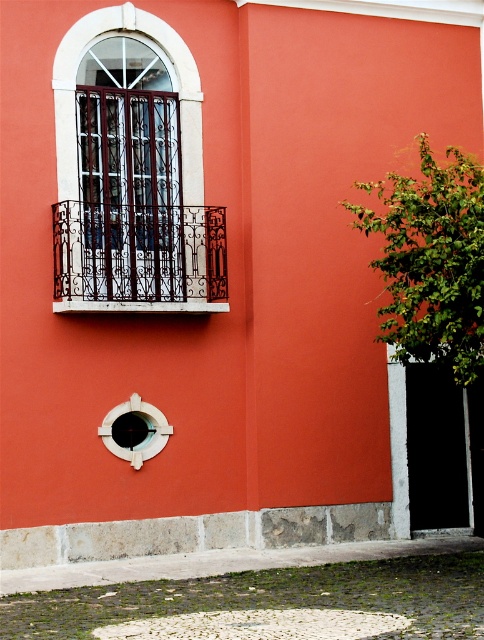
Question: Which object is closer to the camera taking this photo?

Choices:
 (A) smooth white circle at center
 (B) white plastic hole at lower center

Answer: (B)

Question: Among these objects, which one is nearest to the camera?

Choices:
 (A) white wrought iron balcony at upper left
 (B) white plastic hole at lower center
 (C) matte black metal bars at upper left
 (D) smooth white circle at center

Answer: (A)

Question: Does matte black metal bars at upper left appear on the left side of smooth white circle at center?

Choices:
 (A) no
 (B) yes

Answer: (A)

Question: Can you confirm if white wrought iron balcony at upper left is thinner than white plastic hole at lower center?

Choices:
 (A) yes
 (B) no

Answer: (B)

Question: Estimate the real-world distances between objects in this image. Which object is closer to the white plastic hole at lower center?

Choices:
 (A) smooth white circle at center
 (B) white wrought iron balcony at upper left
 (C) matte black metal bars at upper left

Answer: (A)

Question: Can you confirm if white wrought iron balcony at upper left is positioned below white plastic hole at lower center?

Choices:
 (A) no
 (B) yes

Answer: (A)